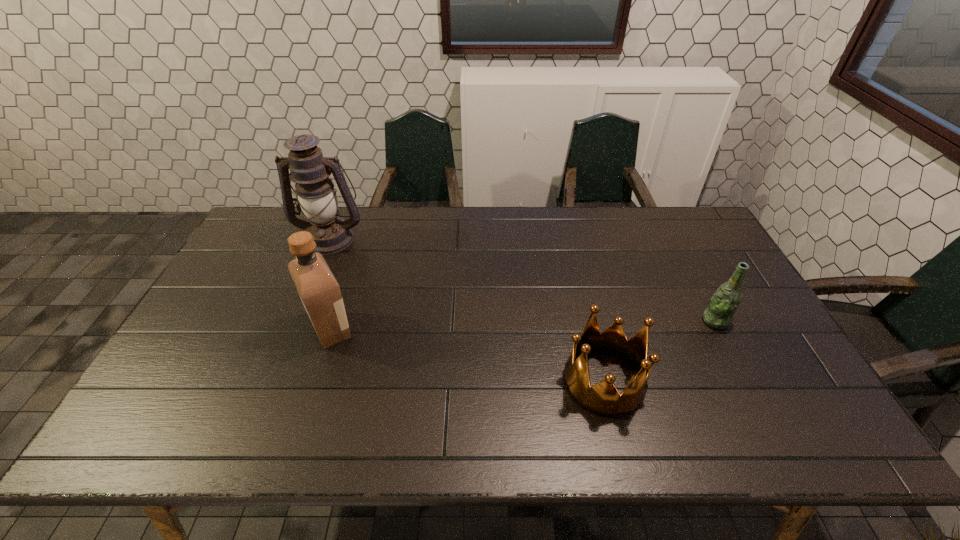
Locate an element on the screen. the farthest object is located at coordinates (316, 196).

Where is `liquor`? Image resolution: width=960 pixels, height=540 pixels. liquor is located at coordinates (320, 293).

Locate an element on the screen. beer bottle is located at coordinates (725, 301).

I want to click on crown, so click(602, 399).

Where is `blank area located on the front of the oil lamp`? Image resolution: width=960 pixels, height=540 pixels. blank area located on the front of the oil lamp is located at coordinates (285, 351).

Locate an element on the screen. vacant space located 0.130m on the front-facing side of the liquor is located at coordinates (405, 329).

Locate an element on the screen. blank space located 0.400m on the surface of the rightmost object is located at coordinates (560, 321).

Find the location of a particular element. This screenshot has height=540, width=960. vacant space located on the surface of the rightmost object is located at coordinates (574, 321).

Locate an element on the screen. The height and width of the screenshot is (540, 960). vacant space located 0.170m on the surface of the rightmost object is located at coordinates (642, 321).

Identify the location of vacant space positioned 0.290m on the back of the crown. This screenshot has height=540, width=960. (578, 275).